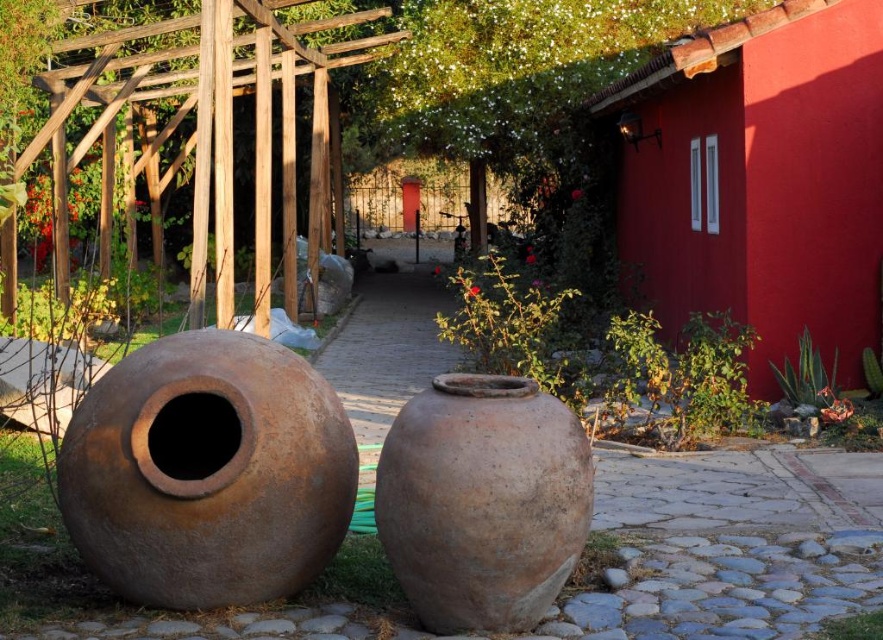
Is point (208, 600) positioned behind point (381, 484)?

Yes, it is.

Is rusty clay pot at left taller than brown clay vase at center?

Indeed, rusty clay pot at left has a greater height compared to brown clay vase at center.

Where is `rusty clay pot at left`? The height and width of the screenshot is (640, 883). rusty clay pot at left is located at coordinates (208, 472).